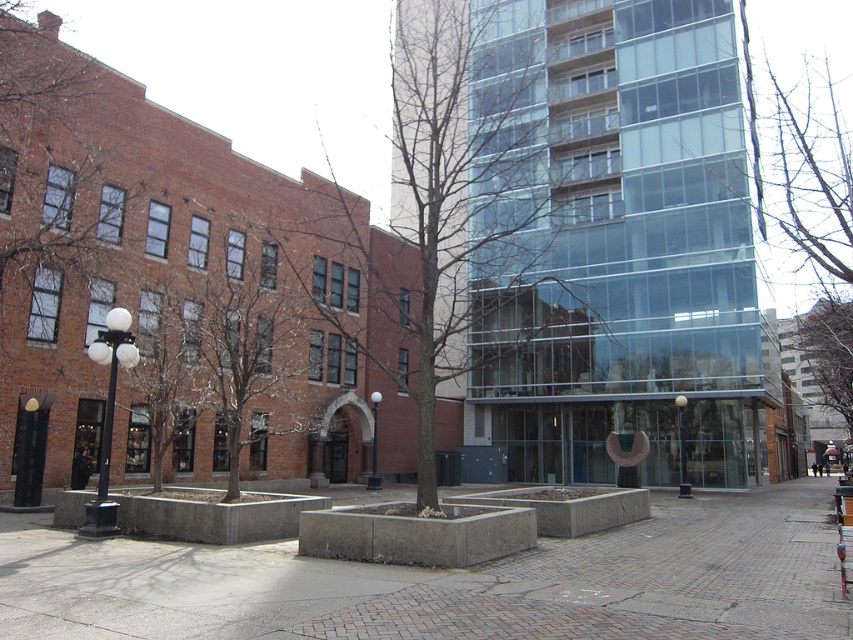
You are observing an urban landscape with two types of trees. The first is a brown textured tree at upper left, and the second is a brown bark tree at left. Which tree is located more to the left in the image?

The brown textured tree at upper left is more to the left than the brown bark tree at left.

You are an urban planner examining the scene. You notice the brown bark tree at center and the bare branches at upper center. Which of these two has a smaller diameter?

The brown bark tree at center is thinner than the bare branches at upper center, so the brown bark tree at center has a smaller diameter.

You are a city planner reviewing the urban scene. You need to determine the spatial relationship between the brown bark tree at center and the bare branches at upper center. Which object is positioned higher in the image?

The brown bark tree at center is located above bare branches at upper center, so the brown bark tree at center is positioned higher in the image.